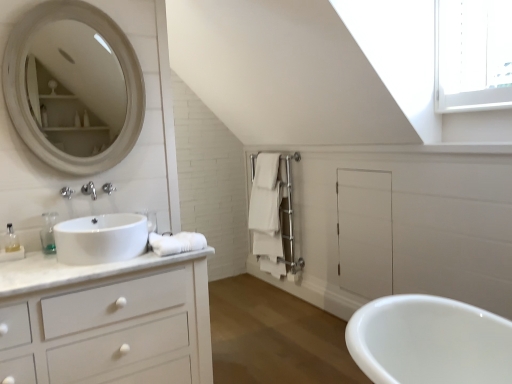
Where is `empty space that is ontop of white glossy sink at left (from a real-world perspective)`? The width and height of the screenshot is (512, 384). empty space that is ontop of white glossy sink at left (from a real-world perspective) is located at coordinates (105, 220).